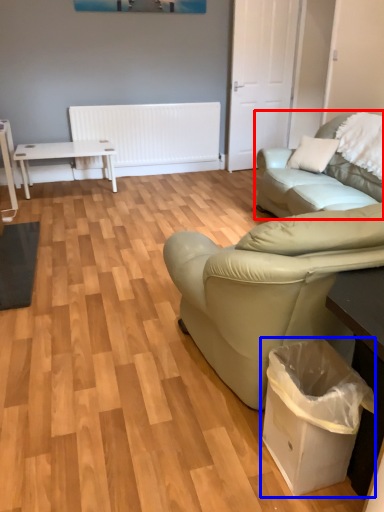
Question: Which object is closer to the camera taking this photo, studio couch (highlighted by a red box) or garbage (highlighted by a blue box)?

Choices:
 (A) studio couch
 (B) garbage

Answer: (B)